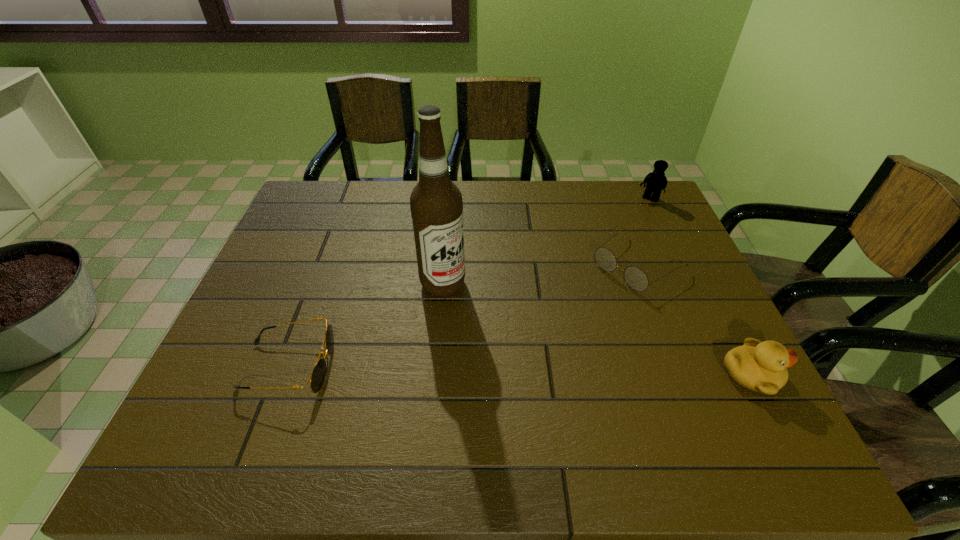
Select which object is the closest to the sunglasses. Please provide its 2D coordinates. Your answer should be formatted as a tuple, i.e. [(x, y)], where the tuple contains the x and y coordinates of a point satisfying the conditions above.

[(436, 205)]

Identify which object is the closest to the spectacles. Please provide its 2D coordinates. Your answer should be formatted as a tuple, i.e. [(x, y)], where the tuple contains the x and y coordinates of a point satisfying the conditions above.

[(656, 181)]

Locate an element on the screen. The height and width of the screenshot is (540, 960). free spot that satisfies the following two spatial constraints: 1. on the front side of the farthest object; 2. on the front-facing side of the duckling is located at coordinates (733, 375).

Where is `vacant area in the image that satisfies the following two spatial constraints: 1. on the back side of the fourth object from right to left; 2. on the right side of the spectacles`? Image resolution: width=960 pixels, height=540 pixels. vacant area in the image that satisfies the following two spatial constraints: 1. on the back side of the fourth object from right to left; 2. on the right side of the spectacles is located at coordinates (444, 264).

The height and width of the screenshot is (540, 960). Identify the location of vacant space that satisfies the following two spatial constraints: 1. on the back side of the farthest object; 2. on the left side of the second object from left to right. (450, 200).